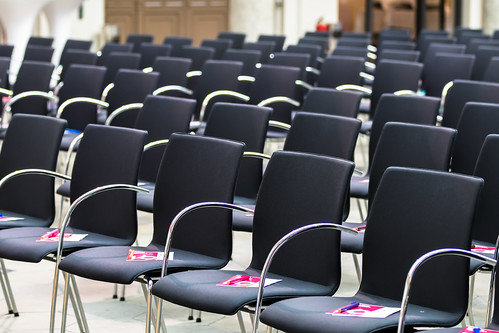
At what (x,y) coordinates should I click in order to perform the action: click on pens. Please return your answer as a coordinate pair (x, y). Looking at the image, I should click on (362, 226), (487, 246), (476, 327), (351, 304), (242, 275), (145, 253), (51, 232), (1, 215), (70, 129).